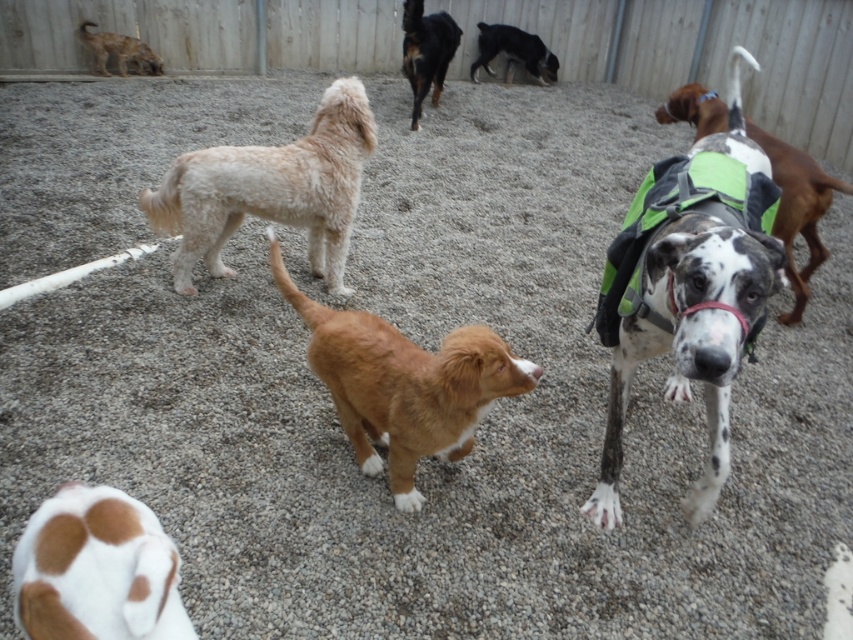
Question: Among these objects, which one is farthest from the camera?

Choices:
 (A) brown/white fur paw at lower left
 (B) black glossy dog at upper center
 (C) brown fuzzy dog at center

Answer: (B)

Question: In this image, where is black glossy dog at upper center located relative to smooth wood pole at upper center?

Choices:
 (A) right
 (B) left

Answer: (A)

Question: Is black and white fur at center bigger than brown fur dog at upper left?

Choices:
 (A) yes
 (B) no

Answer: (A)

Question: Among these points, which one is farthest from the camera?

Choices:
 (A) (616, 483)
 (B) (271, 211)
 (C) (254, 12)
 (D) (450, 49)

Answer: (C)

Question: From the image, what is the correct spatial relationship of brown/white fur paw at lower left in relation to smooth wood pole at upper center?

Choices:
 (A) below
 (B) above

Answer: (A)

Question: Which point appears closest to the camera in this image?

Choices:
 (A) (160, 628)
 (B) (474, 60)

Answer: (A)